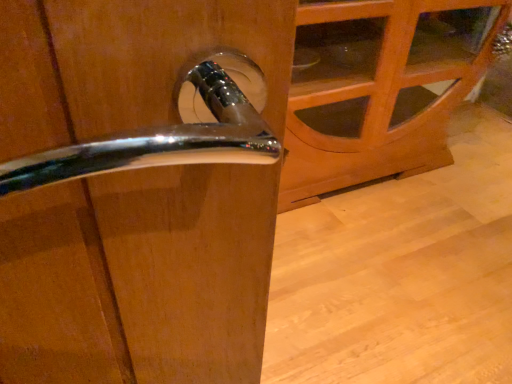
What do you see at coordinates (379, 88) in the screenshot? I see `glossy wood cabinet at center` at bounding box center [379, 88].

Identify the location of glossy wood cabinet at center. The height and width of the screenshot is (384, 512). (379, 88).

The width and height of the screenshot is (512, 384). I want to click on glossy wood cabinet at center, so click(x=379, y=88).